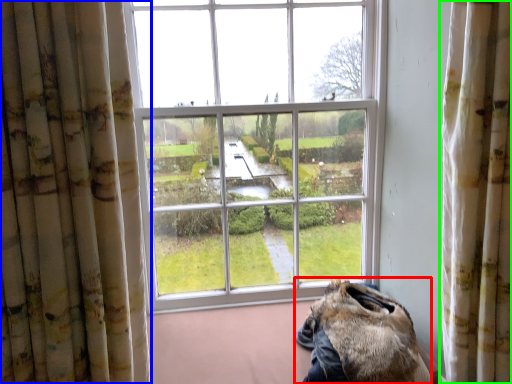
Question: Considering the real-world distances, which object is farthest from animal (highlighted by a red box)? curtain (highlighted by a blue box) or curtain (highlighted by a green box)?

Choices:
 (A) curtain
 (B) curtain

Answer: (A)